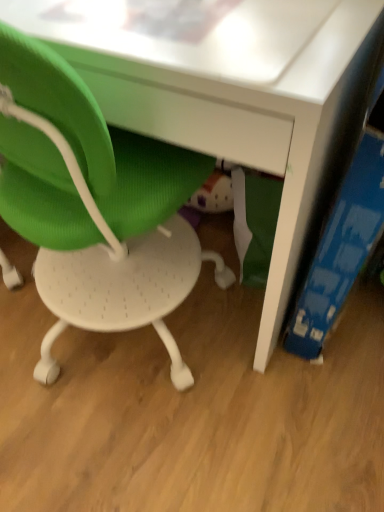
Identify the location of blue cardboard book at right. This screenshot has height=512, width=384. (341, 248).

What do you see at coordinates (341, 248) in the screenshot? I see `blue cardboard book at right` at bounding box center [341, 248].

At what (x,y) coordinates should I click in order to perform the action: click on green mesh chair at lower left. Please return your answer as a coordinate pair (x, y). Image resolution: width=384 pixels, height=512 pixels. Looking at the image, I should click on (94, 205).

The height and width of the screenshot is (512, 384). Describe the element at coordinates (94, 205) in the screenshot. I see `green mesh chair at lower left` at that location.

Measure the distance between green mesh chair at lower left and camera.

The depth of green mesh chair at lower left is 20.70 inches.

What is the approximate width of green mesh chair at lower left?

The width of green mesh chair at lower left is 21.55 inches.

You are a GUI agent. You are given a task and a screenshot of the screen. Output one action in this format:
    pyautogui.click(x=<x>, y=<y>)
    Task: Click on the blue cardboard book at right
    This screenshot has width=384, height=512.
    Given the screenshot: What is the action you would take?
    pyautogui.click(x=341, y=248)

Considering the relative positions of blue cardboard book at right and green mesh chair at lower left in the image provided, is blue cardboard book at right to the left or to the right of green mesh chair at lower left?

Clearly, blue cardboard book at right is on the right of green mesh chair at lower left in the image.

Is blue cardboard book at right in front of or behind green mesh chair at lower left in the image?

blue cardboard book at right is behind green mesh chair at lower left.

Is point (370, 194) farther from viewer compared to point (23, 40)?

Yes, it is.

From the image's perspective, who appears lower, blue cardboard book at right or green mesh chair at lower left?

blue cardboard book at right.

From a real-world perspective, which is physically above, blue cardboard book at right or green mesh chair at lower left?

In real-world perspective, green mesh chair at lower left is above.

Considering the sizes of objects blue cardboard book at right and green mesh chair at lower left in the image provided, who is thinner, blue cardboard book at right or green mesh chair at lower left?

blue cardboard book at right is thinner.

Who is shorter, blue cardboard book at right or green mesh chair at lower left?

blue cardboard book at right is shorter.

Which of these two, blue cardboard book at right or green mesh chair at lower left, is smaller?

blue cardboard book at right.

Would you say blue cardboard book at right is outside green mesh chair at lower left?

blue cardboard book at right is positioned outside green mesh chair at lower left.

Are blue cardboard book at right and green mesh chair at lower left far apart?

No, blue cardboard book at right is not far away from green mesh chair at lower left.

Is blue cardboard book at right facing away from green mesh chair at lower left?

Yes, green mesh chair at lower left is at the back of blue cardboard book at right.

Can you tell me how much blue cardboard book at right and green mesh chair at lower left differ in facing direction?

87.9 degrees separate the facing orientations of blue cardboard book at right and green mesh chair at lower left.

At what (x,y) coordinates should I click in order to perform the action: click on chair that appears in front of the blue cardboard book at right. Please return your answer as a coordinate pair (x, y). Looking at the image, I should click on (94, 205).

Visually, is green mesh chair at lower left positioned to the left or to the right of blue cardboard book at right?

Clearly, green mesh chair at lower left is on the left of blue cardboard book at right in the image.

Is the position of green mesh chair at lower left less distant than that of blue cardboard book at right?

Yes, the depth of green mesh chair at lower left is less than that of blue cardboard book at right.

Which point is more forward, (69,257) or (306,319)?

The point (306,319) is in front.

From the image's perspective, between green mesh chair at lower left and blue cardboard book at right, which one is located above?

From the image's view, green mesh chair at lower left is above.

From a real-world perspective, between green mesh chair at lower left and blue cardboard book at right, who is vertically higher?

green mesh chair at lower left is physically above.

Which of these two, green mesh chair at lower left or blue cardboard book at right, is wider?

green mesh chair at lower left is wider.

Who is shorter, green mesh chair at lower left or blue cardboard book at right?

Standing shorter between the two is blue cardboard book at right.

Is green mesh chair at lower left bigger than blue cardboard book at right?

Yes.

Is green mesh chair at lower left outside of blue cardboard book at right?

That's correct, green mesh chair at lower left is outside of blue cardboard book at right.

Looking at this image, is green mesh chair at lower left beside blue cardboard book at right?

No.

Is blue cardboard book at right at the back of green mesh chair at lower left?

No, green mesh chair at lower left's orientation is not away from blue cardboard book at right.

Consider the image. How different are the orientations of green mesh chair at lower left and blue cardboard book at right in degrees?

87.9 degrees separate the facing orientations of green mesh chair at lower left and blue cardboard book at right.

Where is `chair in front of the blue cardboard book at right`? The height and width of the screenshot is (512, 384). chair in front of the blue cardboard book at right is located at coordinates (94, 205).

I want to click on paperback book behind the green mesh chair at lower left, so tap(341, 248).

Where is `paperback book that appears on the right of green mesh chair at lower left`? This screenshot has width=384, height=512. paperback book that appears on the right of green mesh chair at lower left is located at coordinates (341, 248).